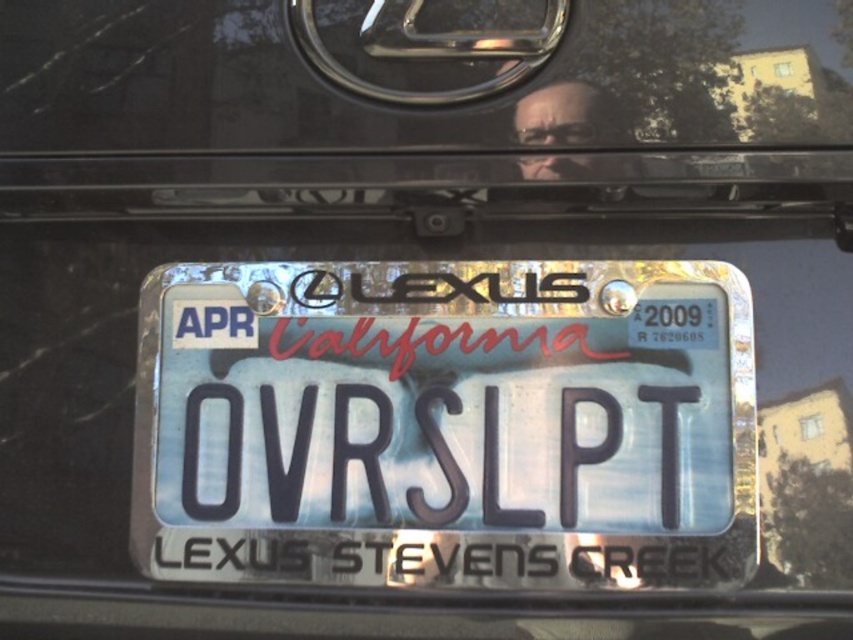
Question: Which of the following is the closest to the observer?

Choices:
 (A) metallic reflective license plate at center
 (B) transparent glass at center

Answer: (B)

Question: Can you confirm if metallic reflective license plate at center is positioned below transparent glass at center?

Choices:
 (A) yes
 (B) no

Answer: (A)

Question: Can you confirm if metallic reflective license plate at center is thinner than transparent glass at center?

Choices:
 (A) no
 (B) yes

Answer: (B)

Question: Which point appears closest to the camera in this image?

Choices:
 (A) (492, 24)
 (B) (697, 525)

Answer: (B)

Question: Is metallic reflective license plate at center behind transparent glass at center?

Choices:
 (A) no
 (B) yes

Answer: (B)